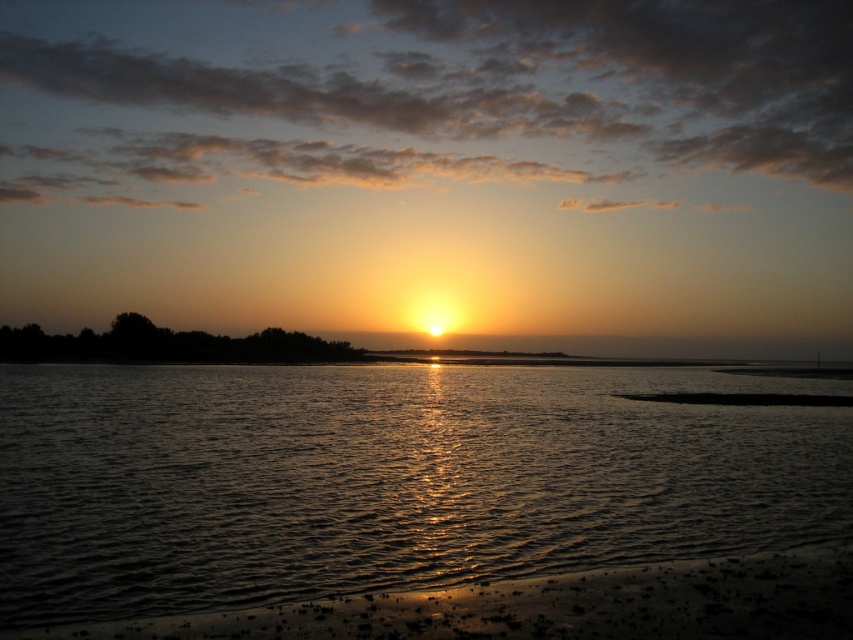
You are standing on the sandy shore at lower center and want to reach the glistening water at center. Which direction should you move in?

You should move to the right to reach the glistening water at center since it is located to the right of the sandy shore at lower center.

You are standing on the sandy shore at lower center and want to reach the glistening water at center. Based on the scene, which direction should you move to get to the water?

You should move towards the center from the sandy shore at lower center to reach the glistening water at center.

You are standing at the edge of the water and see two points in the sunset scene. The first point is at coordinate point (x=473, y=544) and the second is at point (x=524, y=593). Which point is closer to you?

Point (x=473, y=544) is further to the camera than point (x=524, y=593), so the point closer to you is point (x=524, y=593).